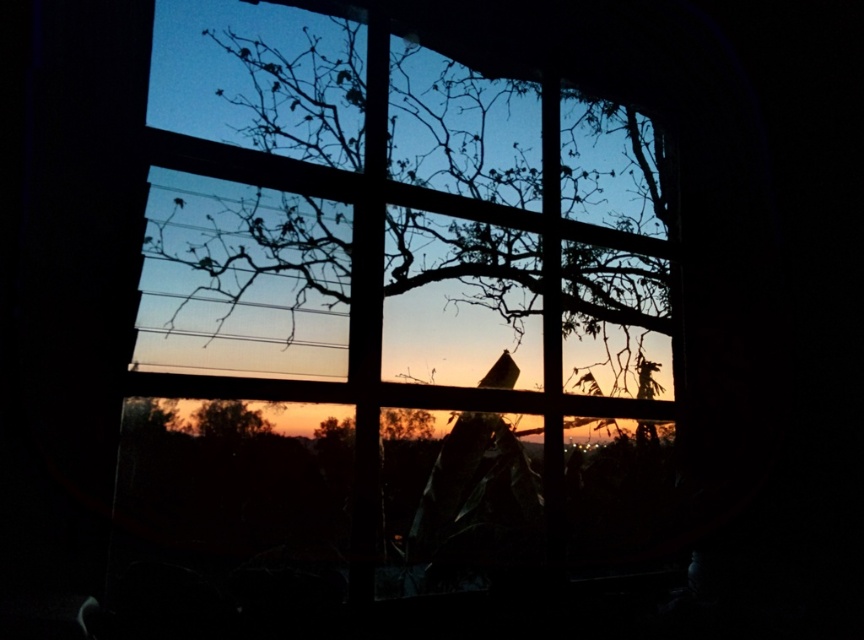
You are an architect designing a new window with a grid pattern. You want to place a decorative silhouette of a tree at point [392,218]. According to the scene, what object is already present at that location?

The silhouette wood tree at center is located at point [392,218].

You are an interior designer assessing the placement of a large painting. The painting is 1.2 meters wide. You need to decide if it can fit between the silhouette wood tree at center and the brown matte tree at lower center. Can it fit?

The silhouette wood tree at center might be wider than brown matte tree at lower center, so the distance between them is uncertain. Without knowing the exact width of the space between the two trees, it is not possible to determine if the 1.2 meter wide painting will fit.